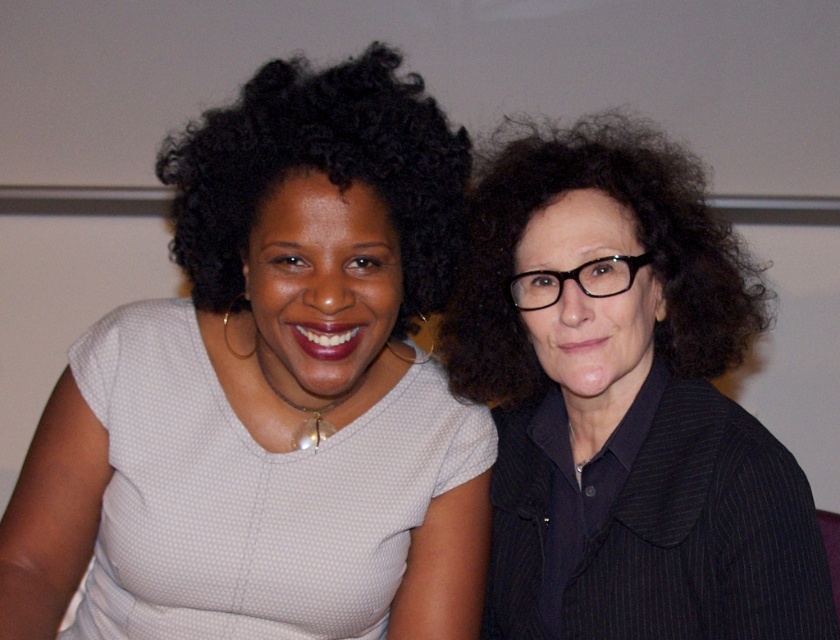
You are a photographer trying to capture a closeup shot of the matte white blouse at center and the black pinstriped blazer at right. The camera you are using has a maximum focus range of 8 inches. Can you focus on both items simultaneously?

The matte white blouse at center is 8.80 inches from the black pinstriped blazer at right. Since the distance between them exceeds the camera maximum focus range of 8 inches, you cannot focus on both items simultaneously.

Consider the image. Looking at the scene, where is the matte white blouse at center in relation to the black curly hair at upper left?

The matte white blouse at center is to the right of the black curly hair at upper left.

You are a fashion designer trying to create a new line of clothing. You observe the matte white blouse at center and the black pinstriped blazer at right in the image. Which of these two garments has a larger size?

The matte white blouse at center is bigger than the black pinstriped blazer at right, so the matte white blouse at center has a larger size.